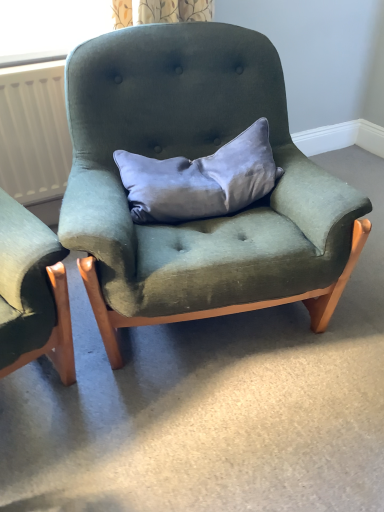
The height and width of the screenshot is (512, 384). Describe the element at coordinates (194, 158) in the screenshot. I see `velvet green armchair at center` at that location.

This screenshot has width=384, height=512. Describe the element at coordinates (34, 133) in the screenshot. I see `white matte radiator at left` at that location.

The width and height of the screenshot is (384, 512). I want to click on satin gray pillow at center, so click(200, 179).

Identify the location of velvet green armchair at center. The height and width of the screenshot is (512, 384). (194, 158).

Between point (4, 151) and point (130, 203), which one is positioned behind?

The point (4, 151) is farther from the camera.

Is white matte radiator at left positioned beyond the bounds of satin gray pillow at center?

Indeed, white matte radiator at left is completely outside satin gray pillow at center.

From the image's perspective, does white matte radiator at left appear higher than satin gray pillow at center?

Yes, from the image's perspective, white matte radiator at left is above satin gray pillow at center.

Considering the positions of objects white matte radiator at left and satin gray pillow at center in the image provided, who is in front, white matte radiator at left or satin gray pillow at center?

satin gray pillow at center.

Consider the image. Considering the sizes of objects velvet green armchair at center and satin gray pillow at center in the image provided, who is thinner, velvet green armchair at center or satin gray pillow at center?

satin gray pillow at center is thinner.

Considering the positions of objects velvet green armchair at center and satin gray pillow at center in the image provided, who is in front, velvet green armchair at center or satin gray pillow at center?

velvet green armchair at center is more forward.

From the image's perspective, is velvet green armchair at center located above or below satin gray pillow at center?

Based on their image positions, velvet green armchair at center is located beneath satin gray pillow at center.

Is white matte radiator at left oriented away from velvet green armchair at center?

No, white matte radiator at left's orientation is not away from velvet green armchair at center.

Is there a large distance between white matte radiator at left and velvet green armchair at center?

No, white matte radiator at left is in close proximity to velvet green armchair at center.

Considering the relative sizes of white matte radiator at left and velvet green armchair at center in the image provided, is white matte radiator at left thinner than velvet green armchair at center?

Correct, the width of white matte radiator at left is less than that of velvet green armchair at center.

Is white matte radiator at left shorter than velvet green armchair at center?

Yes.

Is point (165, 175) positioned after point (55, 74)?

No, (165, 175) is in front of (55, 74).

Is the surface of satin gray pillow at center in direct contact with white matte radiator at left?

No, satin gray pillow at center is not next to white matte radiator at left.

Based on the photo, considering their positions, is satin gray pillow at center located in front of or behind white matte radiator at left?

satin gray pillow at center is positioned closer to the viewer than white matte radiator at left.

Is velvet green armchair at center shorter than white matte radiator at left?

In fact, velvet green armchair at center may be taller than white matte radiator at left.

Does velvet green armchair at center have a greater width compared to white matte radiator at left?

Indeed, velvet green armchair at center has a greater width compared to white matte radiator at left.

Could you tell me if velvet green armchair at center is turned towards white matte radiator at left?

No, velvet green armchair at center is not facing towards white matte radiator at left.

How far apart are satin gray pillow at center and velvet green armchair at center?

6.65 inches.

Could you tell me if satin gray pillow at center is turned towards velvet green armchair at center?

Yes, satin gray pillow at center is turned towards velvet green armchair at center.

Is satin gray pillow at center situated inside velvet green armchair at center or outside?

satin gray pillow at center lies within the bounds of velvet green armchair at center.

Is point (257, 181) behind point (223, 42)?

That is False.

This screenshot has width=384, height=512. What are the coordinates of `pillow below the white matte radiator at left (from the image's perspective)` in the screenshot? It's located at (200, 179).

At what (x,y) coordinates should I click in order to perform the action: click on pillow positioned vertically above the velvet green armchair at center (from a real-world perspective). Please return your answer as a coordinate pair (x, y). Image resolution: width=384 pixels, height=512 pixels. Looking at the image, I should click on (200, 179).

Looking at the image, which one is located closer to satin gray pillow at center, velvet green armchair at center or white matte radiator at left?

velvet green armchair at center.

Consider the image. Looking at the image, which one is located further to white matte radiator at left, velvet green armchair at center or satin gray pillow at center?

satin gray pillow at center.

From the image, which object appears to be farther from velvet green armchair at center, satin gray pillow at center or white matte radiator at left?

white matte radiator at left is positioned further to the anchor velvet green armchair at center.

Looking at the image, which one is located further to satin gray pillow at center, white matte radiator at left or velvet green armchair at center?

The object further to satin gray pillow at center is white matte radiator at left.

Considering their positions, is satin gray pillow at center positioned closer to white matte radiator at left than velvet green armchair at center?

Based on the image, velvet green armchair at center appears to be nearer to white matte radiator at left.

When comparing their distances from velvet green armchair at center, does white matte radiator at left or satin gray pillow at center seem further?

Among the two, white matte radiator at left is located further to velvet green armchair at center.

I want to click on chair between white matte radiator at left and satin gray pillow at center in the horizontal direction, so click(x=194, y=158).